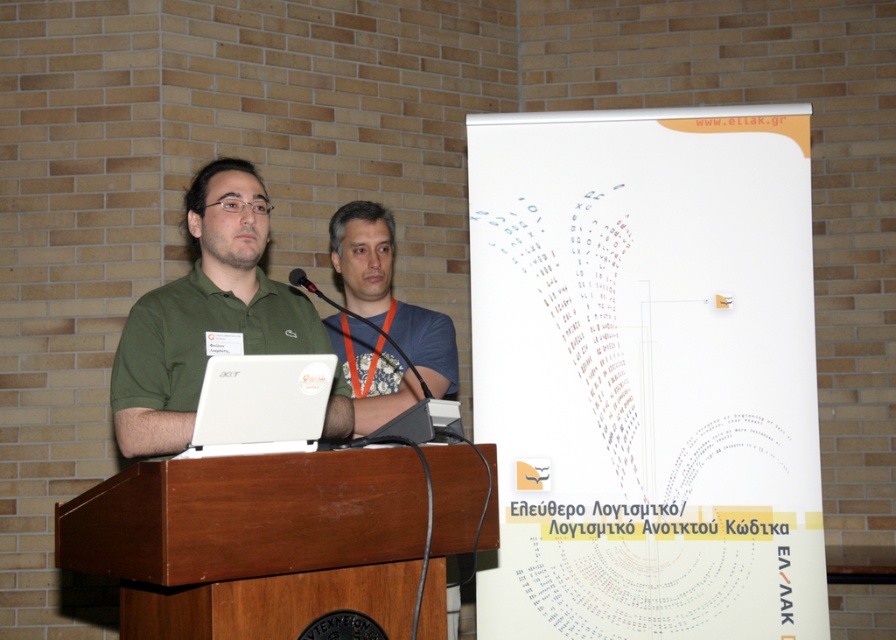
Measure the distance between white matte laptop at center and matte black microphone at center.

They are 16.58 inches apart.

Between white matte laptop at center and matte black microphone at center, which one is positioned higher?

Positioned higher is matte black microphone at center.

Which is in front, point (204, 420) or point (411, 364)?

Point (204, 420)

Locate an element on the screen. The height and width of the screenshot is (640, 896). white matte laptop at center is located at coordinates (260, 404).

Between point (266, 442) and point (300, 273), which one is positioned in front?

Point (266, 442) is in front.

Can you confirm if white matte laptop at center is positioned below black plastic microphone at center?

Correct, white matte laptop at center is located below black plastic microphone at center.

Measure the distance between white matte laptop at center and camera.

white matte laptop at center is 8.89 feet away from camera.

The image size is (896, 640). What are the coordinates of `white matte laptop at center` in the screenshot? It's located at (260, 404).

Is green matte shirt at center bigger than matte black microphone at center?

Indeed, green matte shirt at center has a larger size compared to matte black microphone at center.

Find the location of a particular element. The height and width of the screenshot is (640, 896). green matte shirt at center is located at coordinates (205, 314).